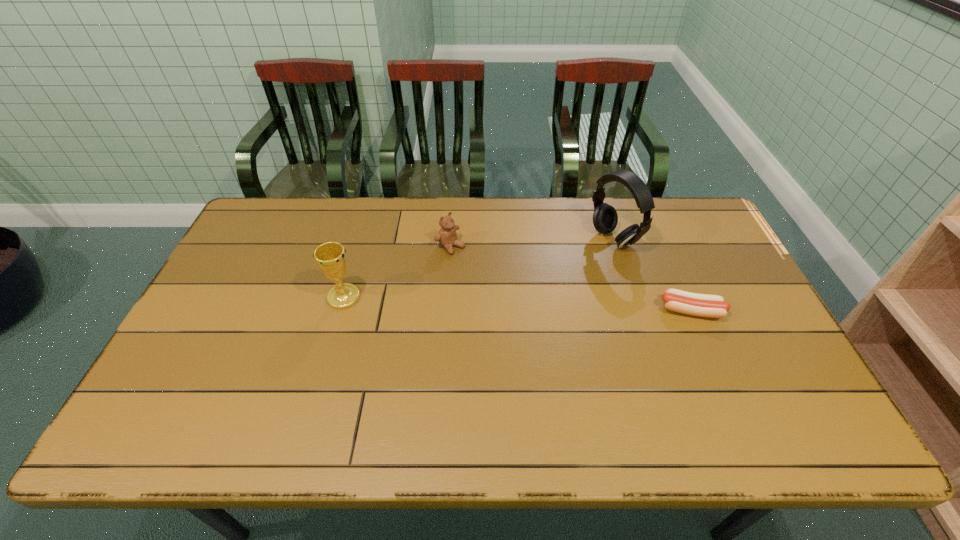
I want to click on chalice, so click(x=330, y=257).

This screenshot has width=960, height=540. Find the location of `the third shortest object`. the third shortest object is located at coordinates 330,257.

Locate an element on the screen. the shortest object is located at coordinates (703, 305).

Locate an element on the screen. earphone is located at coordinates (605, 218).

The image size is (960, 540). I want to click on the second shortest object, so click(x=447, y=236).

Image resolution: width=960 pixels, height=540 pixels. Identify the location of teddy bear. (447, 236).

Identify the location of vacant space situated on the back of the second tallest object. (355, 255).

At what (x,y) coordinates should I click in order to perform the action: click on free space located on the front of the sausage. Please return your answer as a coordinate pair (x, y). Looking at the image, I should click on (727, 393).

The image size is (960, 540). I want to click on free space located 0.250m on the ear cups of the tallest object, so click(535, 280).

Identify the location of free spot located on the ear cups of the tallest object. (565, 265).